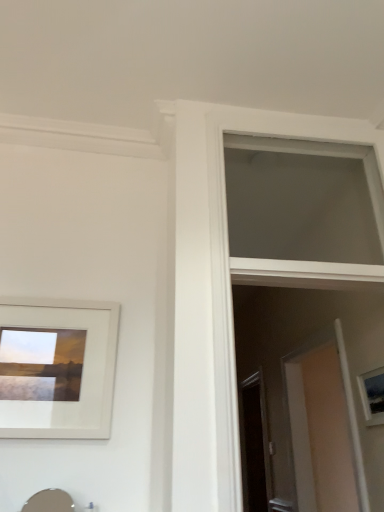
Question: Is transparent glass screen door at center further to camera compared to white matte picture frame at upper left, the 2th picture frame when ordered from right to left?

Choices:
 (A) no
 (B) yes

Answer: (B)

Question: Is transparent glass screen door at center at the right side of white matte picture frame at upper left, arranged as the 2th picture frame when viewed from the back?

Choices:
 (A) no
 (B) yes

Answer: (B)

Question: Is transparent glass screen door at center bigger than white matte picture frame at upper left, marked as the 1th picture frame in a front-to-back arrangement?

Choices:
 (A) no
 (B) yes

Answer: (B)

Question: Is transparent glass screen door at center looking in the opposite direction of white matte picture frame at upper left, the 2th picture frame when ordered from right to left?

Choices:
 (A) no
 (B) yes

Answer: (A)

Question: From the image's perspective, is transparent glass screen door at center beneath white matte picture frame at upper left, the 2th picture frame when ordered from right to left?

Choices:
 (A) no
 (B) yes

Answer: (B)

Question: Can you confirm if transparent glass screen door at center is thinner than white matte picture frame at upper left, the 1th picture frame in the left-to-right sequence?

Choices:
 (A) yes
 (B) no

Answer: (B)

Question: Is white matte window at upper center oriented towards matte silver sink at lower left?

Choices:
 (A) yes
 (B) no

Answer: (B)

Question: Is the position of white matte window at upper center less distant than that of matte silver sink at lower left?

Choices:
 (A) no
 (B) yes

Answer: (A)

Question: From the image's perspective, is white matte window at upper center above matte silver sink at lower left?

Choices:
 (A) no
 (B) yes

Answer: (B)

Question: Does white matte window at upper center have a greater width compared to matte silver sink at lower left?

Choices:
 (A) no
 (B) yes

Answer: (B)

Question: Does white matte window at upper center appear on the right side of matte silver sink at lower left?

Choices:
 (A) yes
 (B) no

Answer: (A)

Question: From the image's perspective, does white matte window at upper center appear lower than matte silver sink at lower left?

Choices:
 (A) no
 (B) yes

Answer: (A)

Question: Could you tell me if matte white picture frame at right, which appears as the 2th picture frame when viewed from the front, is turned towards white matte picture frame at upper left, the 1th picture frame in the left-to-right sequence?

Choices:
 (A) no
 (B) yes

Answer: (B)